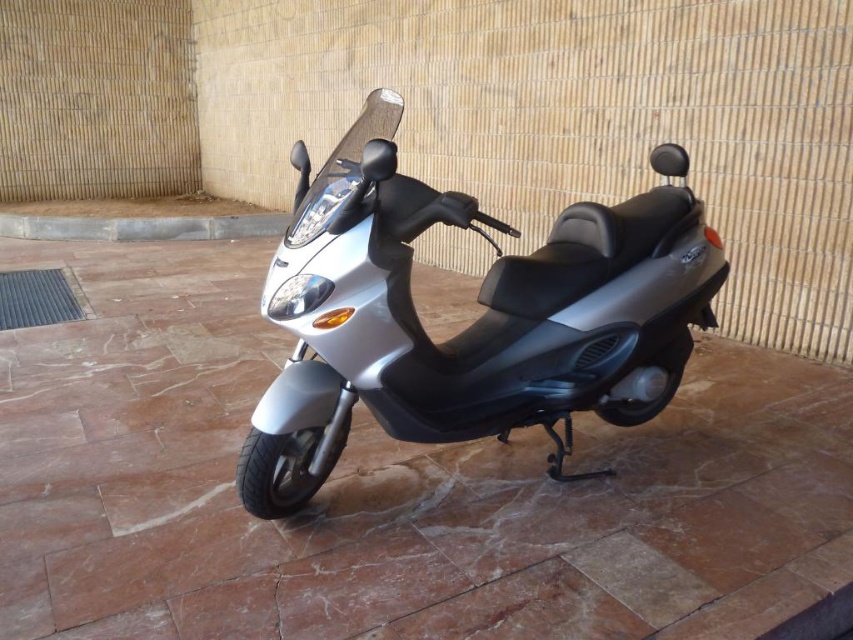
Between silver metallic scooter at center and concrete at lower center, which one is positioned higher?

concrete at lower center is higher up.

Based on the photo, which of these two, silver metallic scooter at center or concrete at lower center, stands shorter?

concrete at lower center is shorter.

Measure the distance between silver metallic scooter at center and camera.

A distance of 5.20 feet exists between silver metallic scooter at center and camera.

Identify the location of silver metallic scooter at center. The image size is (853, 640). (473, 323).